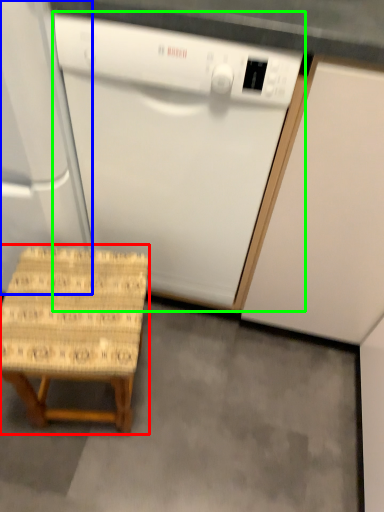
Question: Based on their relative distances, which object is farther from stool (highlighted by a red box)? Choose from appliance (highlighted by a blue box) and home appliance (highlighted by a green box).

Choices:
 (A) appliance
 (B) home appliance

Answer: (B)